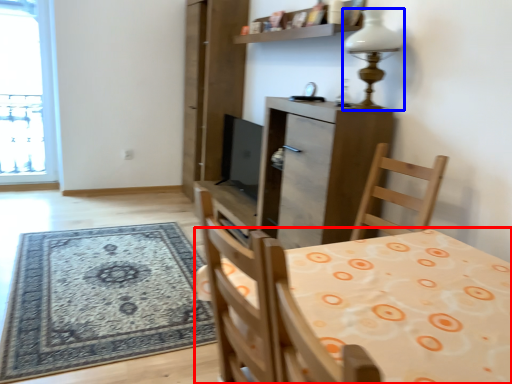
Question: Which point is closer to the camera, table (highlighted by a red box) or lamp (highlighted by a blue box)?

Choices:
 (A) table
 (B) lamp

Answer: (A)